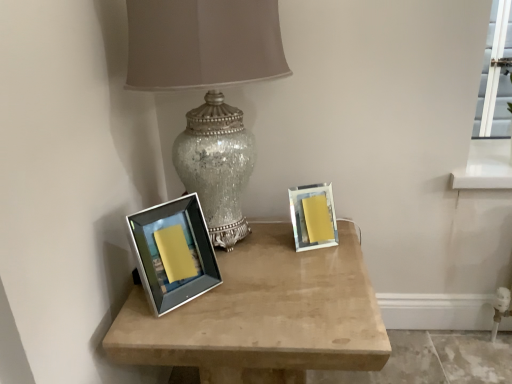
Image resolution: width=512 pixels, height=384 pixels. I want to click on vacant area that lies between crackle glass lamp at center and silver/metallic picture frame at left, which appears as the 2th picture frame when viewed from the right, so click(x=234, y=289).